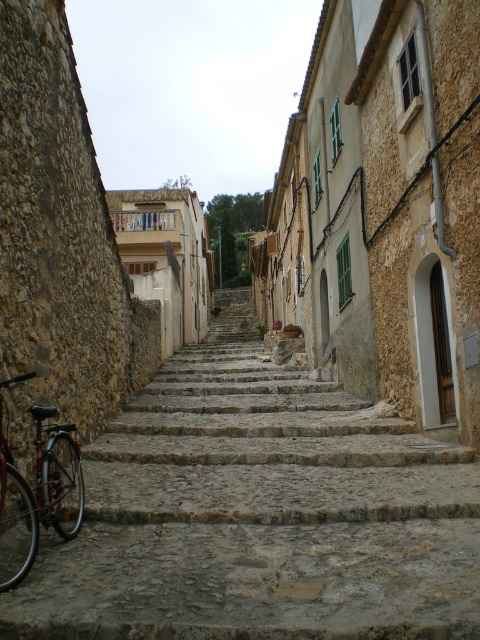
Does stone steps at center have a lesser width compared to shiny metallic bicycle at left?

No.

Is stone steps at center above shiny metallic bicycle at left?

Yes.

Image resolution: width=480 pixels, height=640 pixels. I want to click on stone steps at center, so click(260, 515).